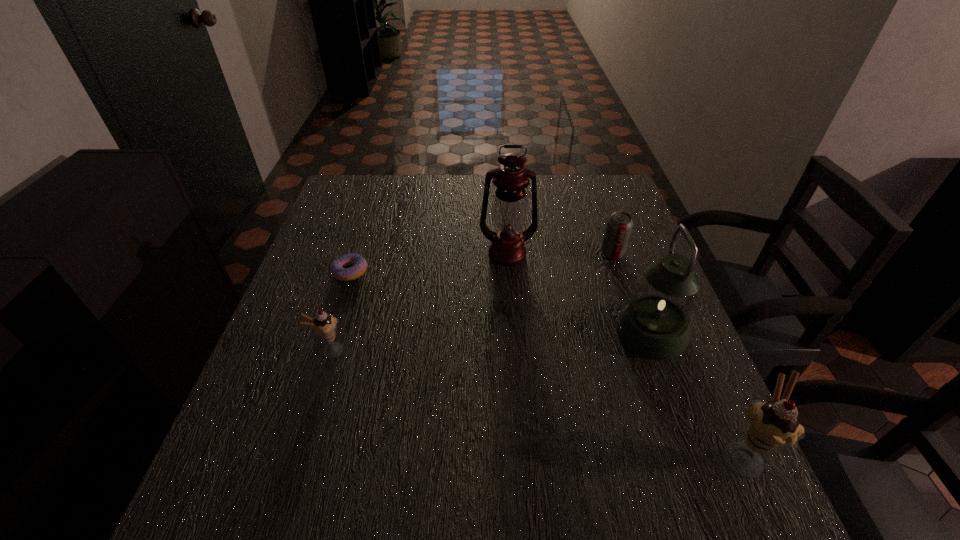
Please point a space for a new icecream to maintain equal intervals. Please provide its 2D coordinates. Your answer should be formatted as a tuple, i.e. [(x, y)], where the tuple contains the x and y coordinates of a point satisfying the conditions above.

[(516, 397)]